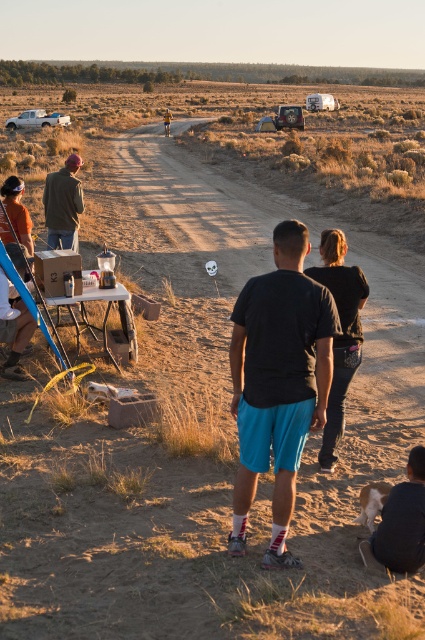
Question: Does black matte shirt at center have a greater width compared to wooden picnic table at lower left?

Choices:
 (A) yes
 (B) no

Answer: (B)

Question: Is matte green jacket at left positioned before white matte truck at left?

Choices:
 (A) no
 (B) yes

Answer: (B)

Question: Which point is farther from the camera taking this photo?

Choices:
 (A) (x=234, y=410)
 (B) (x=65, y=163)

Answer: (B)

Question: Which object appears closest to the camera in this image?

Choices:
 (A) white matte truck at left
 (B) black matte shirt at center
 (C) matte green jacket at left
 (D) wooden picnic table at lower left

Answer: (B)

Question: Can you confirm if black matte shirt at center is positioned to the left of wooden picnic table at lower left?

Choices:
 (A) no
 (B) yes

Answer: (A)

Question: Which is farther from the wooden picnic table at lower left?

Choices:
 (A) white matte truck at left
 (B) black matte shirt at center

Answer: (A)